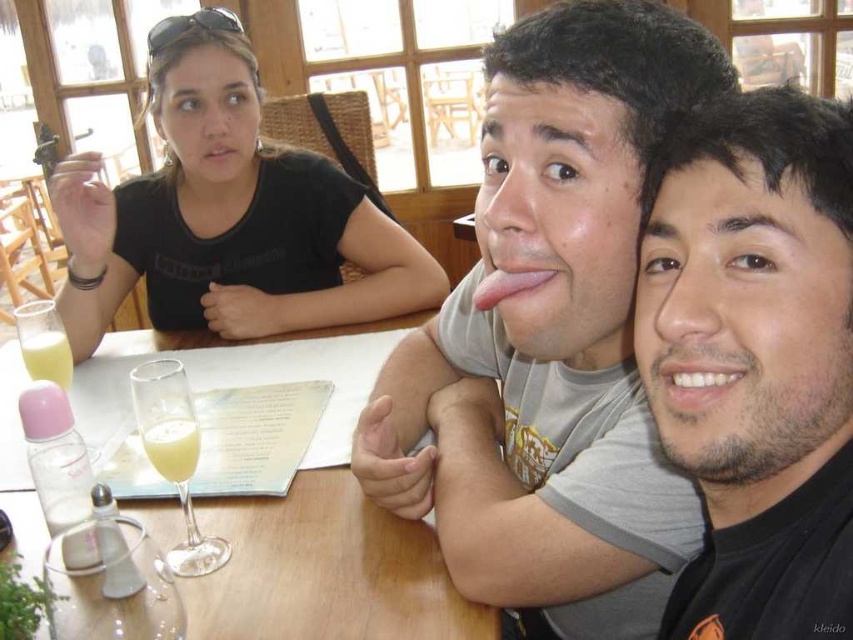
In the image, there are two men and a woman seated at a wooden table. The two men are wearing a gray t shirt and a black t shirt respectively. The woman is wearing a black t shirt with sunglasses on. There is a point at coordinate (x=555, y=332). What is located at that point?

The gray matte t shirt at center is located at point (x=555, y=332).

You are a photographer standing at the center of the room. You want to take a photo of the point at coordinate point (621, 243). The camera you are using has a minimum focus distance of 24 inches. Will the camera be able to focus on the point?

The point (621, 243) is 24.38 inches away from viewer. Since the minimum focus distance is 24 inches, the camera can focus on the point as it is slightly beyond the minimum distance.

You are trying to locate the black matte face at center in the image. According to the coordinates provided, where exactly is it positioned?

The black matte face at center is positioned at coordinates point (758, 358).